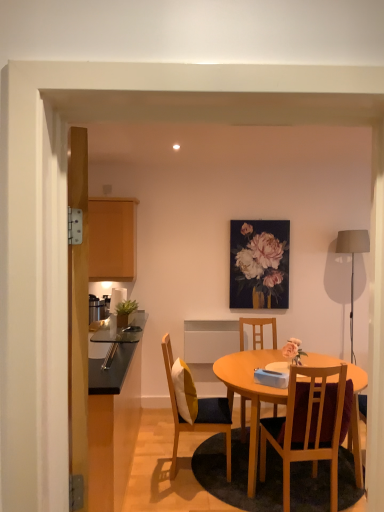
Question: Considering the relative sizes of wooden table at center and wooden chair with cushion at center, the 2th chair positioned from the front, in the image provided, is wooden table at center wider than wooden chair with cushion at center, the 2th chair positioned from the front,?

Choices:
 (A) no
 (B) yes

Answer: (B)

Question: Is wooden table at center at the right side of wooden chair with cushion at center, arranged as the 3th chair when viewed from the right?

Choices:
 (A) yes
 (B) no

Answer: (A)

Question: From the image's perspective, does wooden table at center appear lower than wooden chair with cushion at center, the 2th chair when ordered from back to front?

Choices:
 (A) yes
 (B) no

Answer: (A)

Question: Does wooden table at center have a greater height compared to wooden chair with cushion at center, the 1th chair from the left?

Choices:
 (A) no
 (B) yes

Answer: (A)

Question: Is wooden table at center next to wooden chair with cushion at center, the 2th chair when ordered from back to front?

Choices:
 (A) yes
 (B) no

Answer: (B)

Question: From the image's perspective, is wooden table at center located above or below wooden chair at center, which appears as the 1th chair when viewed from the front?

Choices:
 (A) above
 (B) below

Answer: (B)

Question: In terms of width, does wooden table at center look wider or thinner when compared to wooden chair at center, the 3th chair in the back-to-front sequence?

Choices:
 (A) thin
 (B) wide

Answer: (B)

Question: Is wooden table at center bigger or smaller than wooden chair at center, placed as the 3th chair when sorted from left to right?

Choices:
 (A) small
 (B) big

Answer: (B)

Question: In the image, is wooden table at center on the left side or the right side of wooden chair at center, the 3th chair in the back-to-front sequence?

Choices:
 (A) right
 (B) left

Answer: (A)

Question: Is wooden chair at center, the 3th chair in the back-to-front sequence, bigger or smaller than wooden chair at center, the first chair in the back-to-front sequence?

Choices:
 (A) small
 (B) big

Answer: (B)

Question: Is wooden chair at center, which appears as the 1th chair when viewed from the front, taller or shorter than wooden chair at center, the first chair in the back-to-front sequence?

Choices:
 (A) short
 (B) tall

Answer: (B)

Question: Would you say wooden chair at center, which appears as the 1th chair when viewed from the front, is inside or outside wooden chair at center, the third chair positioned from the front?

Choices:
 (A) inside
 (B) outside

Answer: (B)

Question: In the image, is wooden chair at center, arranged as the first chair when viewed from the right, positioned in front of or behind wooden chair at center, which ranks as the 2th chair in left-to-right order?

Choices:
 (A) front
 (B) behind

Answer: (A)

Question: From a real-world perspective, is matte gray fabric lampshade at right physically located above or below wooden chair at center, placed as the 3th chair when sorted from left to right?

Choices:
 (A) below
 (B) above

Answer: (B)

Question: Based on their positions, is matte gray fabric lampshade at right located to the left or right of wooden chair at center, arranged as the first chair when viewed from the right?

Choices:
 (A) right
 (B) left

Answer: (A)